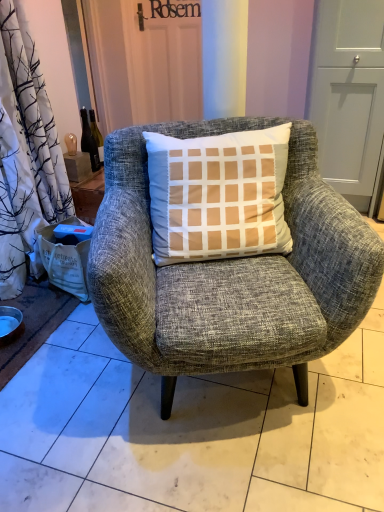
Question: Can you confirm if matte gray screen door at upper right is positioned to the right of matte silver bowl at lower left?

Choices:
 (A) yes
 (B) no

Answer: (A)

Question: Can you confirm if matte gray screen door at upper right is wider than matte silver bowl at lower left?

Choices:
 (A) yes
 (B) no

Answer: (A)

Question: Would you say matte gray screen door at upper right is a long distance from matte silver bowl at lower left?

Choices:
 (A) yes
 (B) no

Answer: (A)

Question: From a real-world perspective, is matte gray screen door at upper right physically below matte silver bowl at lower left?

Choices:
 (A) yes
 (B) no

Answer: (B)

Question: From the image's perspective, is matte gray screen door at upper right on top of matte silver bowl at lower left?

Choices:
 (A) yes
 (B) no

Answer: (A)

Question: Does point click(87, 147) appear closer or farther from the camera than point click(13, 323)?

Choices:
 (A) closer
 (B) farther

Answer: (B)

Question: From the image's perspective, is translucent glass bottle at upper left located above or below matte silver bowl at lower left?

Choices:
 (A) below
 (B) above

Answer: (B)

Question: Is translucent glass bottle at upper left to the left or to the right of matte silver bowl at lower left in the image?

Choices:
 (A) right
 (B) left

Answer: (A)

Question: Considering the positions of translucent glass bottle at upper left and matte silver bowl at lower left in the image, is translucent glass bottle at upper left taller or shorter than matte silver bowl at lower left?

Choices:
 (A) tall
 (B) short

Answer: (A)

Question: Considering the positions of matte silver bowl at lower left and white paper bag at lower left in the image, is matte silver bowl at lower left wider or thinner than white paper bag at lower left?

Choices:
 (A) thin
 (B) wide

Answer: (A)

Question: Is point (4, 342) positioned closer to the camera than point (51, 270)?

Choices:
 (A) farther
 (B) closer

Answer: (B)

Question: Is matte silver bowl at lower left in front of or behind white paper bag at lower left in the image?

Choices:
 (A) front
 (B) behind

Answer: (A)

Question: From a real-world perspective, relative to white paper bag at lower left, is matte silver bowl at lower left vertically above or below?

Choices:
 (A) below
 (B) above

Answer: (A)

Question: From the image's perspective, is white paper bag at lower left located above or below translucent glass bottle at upper left?

Choices:
 (A) below
 (B) above

Answer: (A)

Question: From a real-world perspective, is white paper bag at lower left above or below translucent glass bottle at upper left?

Choices:
 (A) below
 (B) above

Answer: (A)